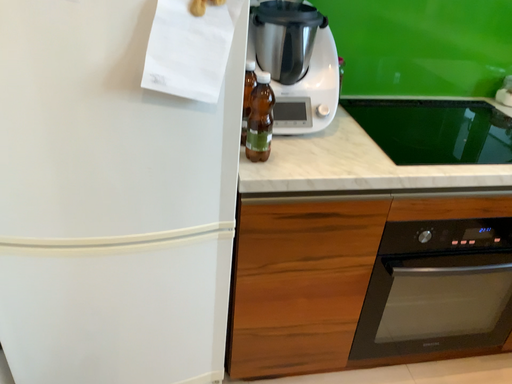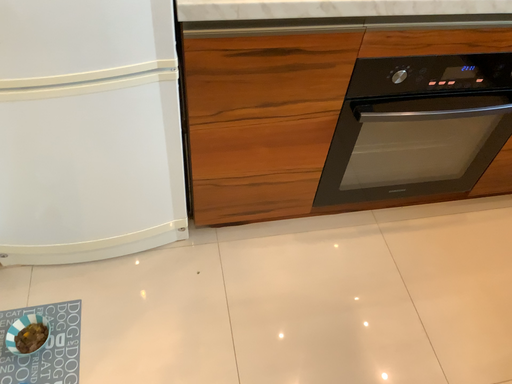
Question: Which way did the camera rotate in the video?

Choices:
 (A) rotated upward
 (B) rotated downward

Answer: (B)